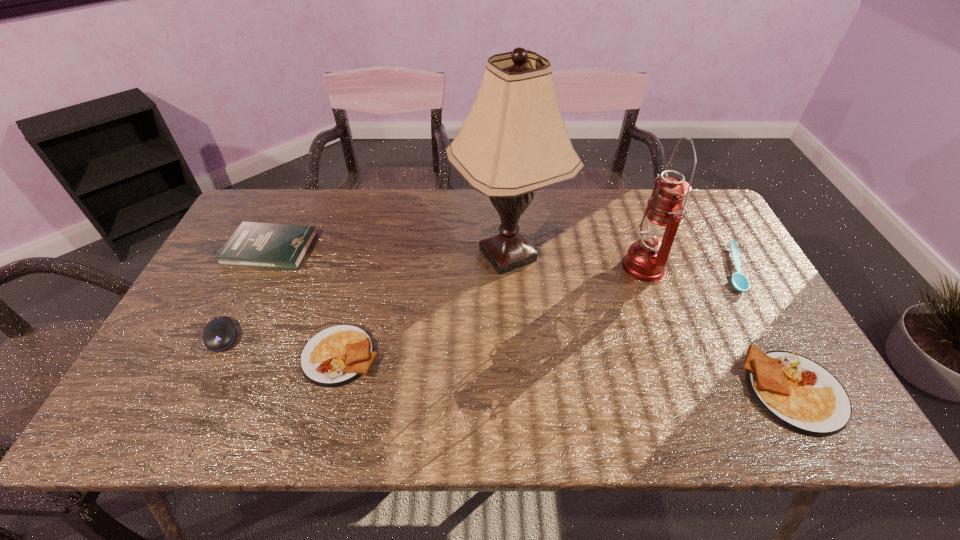
To make them evenly spaced by inserting another omelet among them, please locate a free space for this new omelet. Please provide its 2D coordinates. Your answer should be formatted as a tuple, i.e. [(x, y)], where the tuple contains the x and y coordinates of a point satisfying the conditions above.

[(560, 373)]